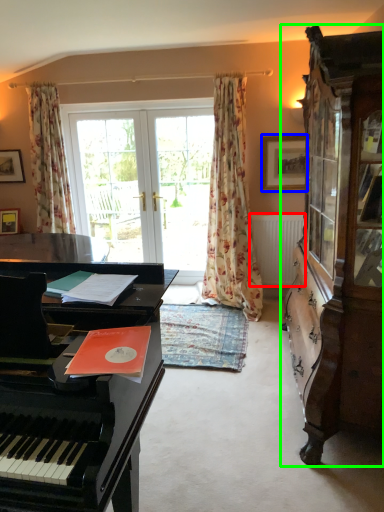
Question: Which object is positioned closest to radiator (highlighted by a red box)? Select from picture frame (highlighted by a blue box) and cabinetry (highlighted by a green box).

Choices:
 (A) picture frame
 (B) cabinetry

Answer: (A)